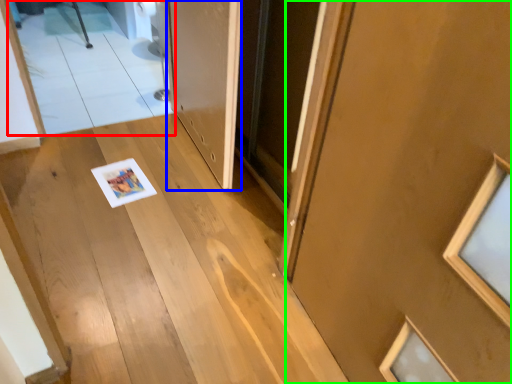
Question: Estimate the real-world distances between objects in this image. Which object is farther from mirror (highlighted by a red box), door (highlighted by a blue box) or door (highlighted by a green box)?

Choices:
 (A) door
 (B) door

Answer: (B)